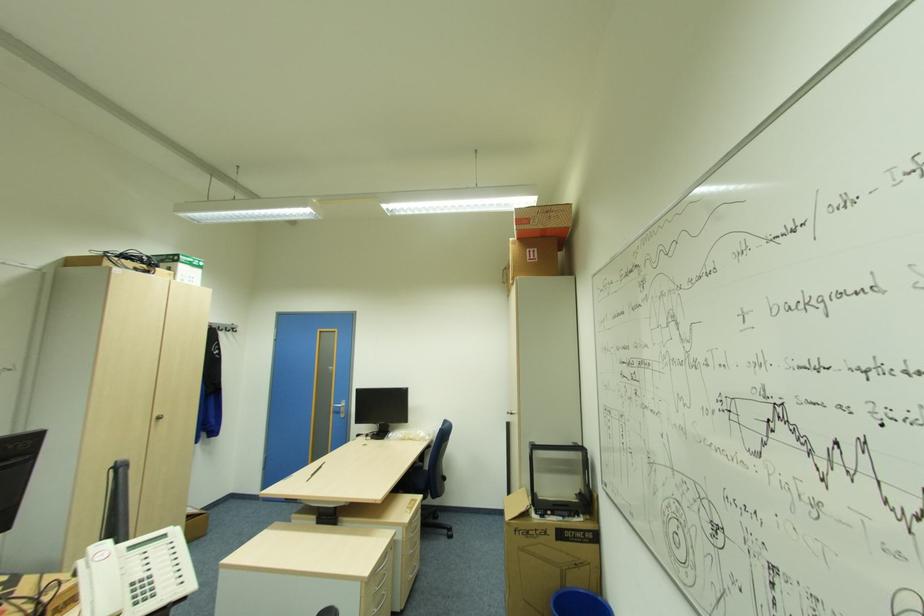
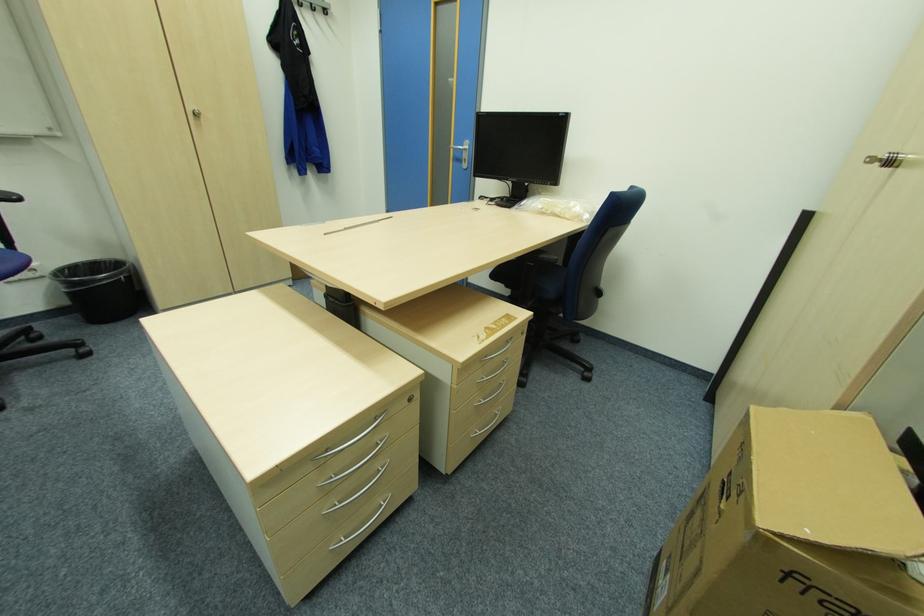
Find the pixel in the second image that matches (511,411) in the first image.

(873, 159)